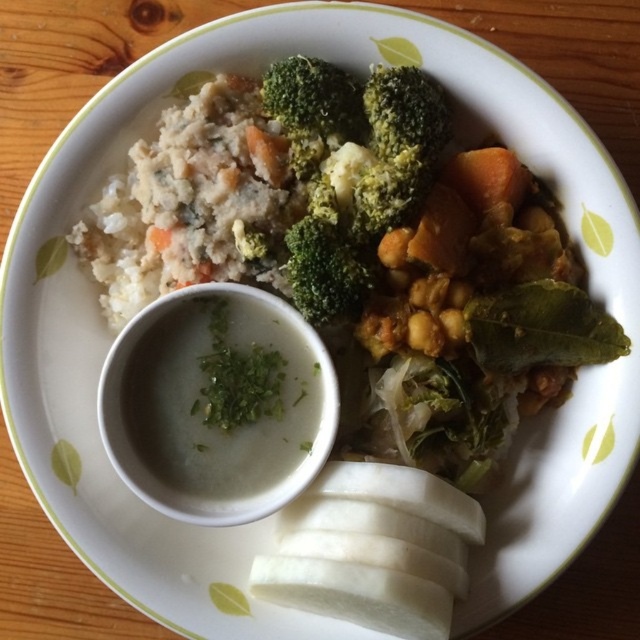
Question: Can you confirm if white creamy soup at center is smaller than green matte broccoli at center?

Choices:
 (A) yes
 (B) no

Answer: (A)

Question: Which object is farther from the camera taking this photo?

Choices:
 (A) white creamy soup at center
 (B) white fluffy rice at upper left
 (C) green matte broccoli at center

Answer: (A)

Question: Among these points, which one is nearest to the camera?

Choices:
 (A) (388, 204)
 (B) (204, 388)

Answer: (A)

Question: Does white fluffy rice at upper left have a greater width compared to green matte broccoli at center?

Choices:
 (A) no
 (B) yes

Answer: (B)

Question: Which point appears farthest from the camera in this image?

Choices:
 (A) (161, 388)
 (B) (404, 224)

Answer: (A)

Question: Can you confirm if white creamy soup at center is thinner than green matte broccoli at center?

Choices:
 (A) yes
 (B) no

Answer: (B)